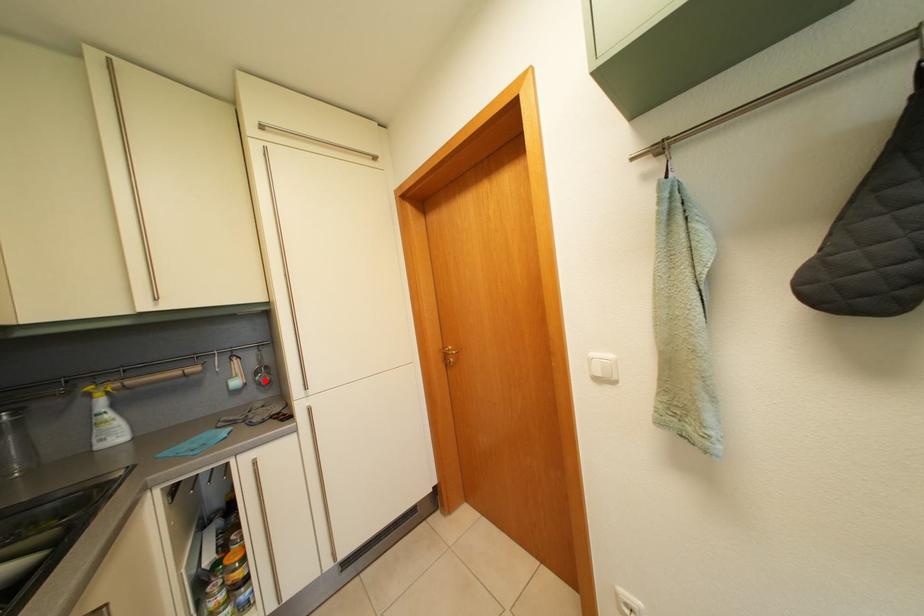
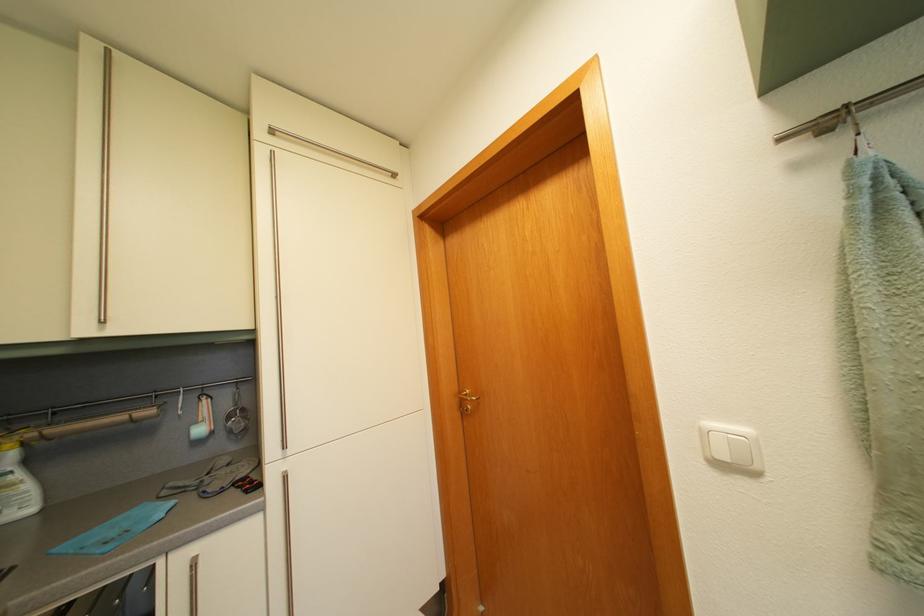
Find the pixel in the second image that matches the highlighted location in the first image.

(237, 424)